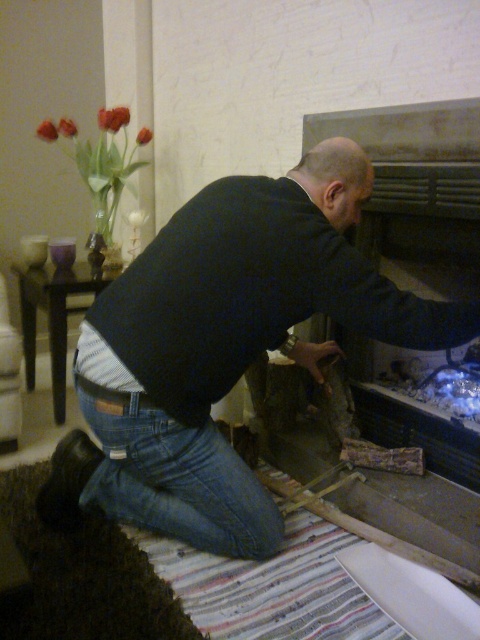
You are a fashion designer observing the man in the image. You need to create a new outfit that accommodates both the dark blue sweater at center and the denim at lower left. Considering their sizes, which item should you prioritize in terms of space when designing the outfit?

The dark blue sweater at center has a larger width than the denim at lower left, so you should prioritize the dark blue sweater at center in terms of space when designing the outfit to ensure proper fit and comfort.

You are a fashion designer observing a man in a living room. You see the dark blue sweater at center and the denim at lower left. Which clothing item is more to the right?

The dark blue sweater at center is positioned on the right side of denim at lower left, so it is more to the right.